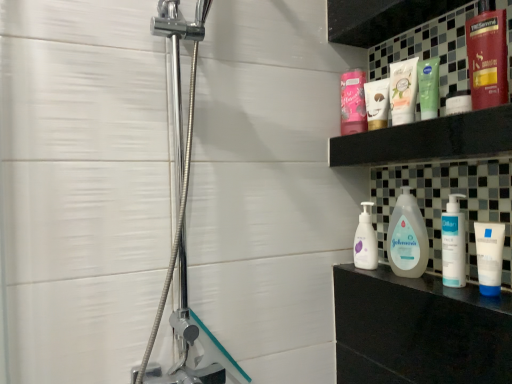
At what (x,y) coordinates should I click in order to perform the action: click on matte pink lotion at upper center, the 5th toiletry in the front-to-back sequence. Please return your answer as a coordinate pair (x, y). Image resolution: width=512 pixels, height=384 pixels. Looking at the image, I should click on (377, 103).

Based on the photo, what is the approximate height of shiny red hair conditioner at upper right, the 1th toiletry when ordered from front to back?

8.60 inches.

Where is `white pump bottle at right, which is counted as the third toiletry, starting from the front`? white pump bottle at right, which is counted as the third toiletry, starting from the front is located at coordinates (453, 243).

Identify the location of white matte pump bottle at right, which appears as the second cleaning product when viewed from the front. (365, 241).

Locate an element on the screen. The width and height of the screenshot is (512, 384). matte pink lotion at upper center, the second toiletry positioned from the back is located at coordinates (377, 103).

Is matte plastic bottles at upper right at the left side of white matte pump bottle at right, which appears as the second cleaning product when viewed from the front?

In fact, matte plastic bottles at upper right is to the right of white matte pump bottle at right, which appears as the second cleaning product when viewed from the front.

In the image, is matte plastic bottles at upper right positioned in front of or behind white matte pump bottle at right, which appears as the second cleaning product when viewed from the front?

In the image, matte plastic bottles at upper right appears in front of white matte pump bottle at right, which appears as the second cleaning product when viewed from the front.

Which is correct: matte plastic bottles at upper right is inside white matte pump bottle at right, which appears as the second cleaning product when viewed from the front, or outside of it?

The correct answer is: outside.

From the picture: From the image's perspective, which one is positioned higher, white matte pump bottle at right, which appears as the second cleaning product when viewed from the front, or pink matte jar at upper center, the 6th toiletry positioned from the front?

From the image's view, pink matte jar at upper center, the 6th toiletry positioned from the front, is above.

Is point (369, 260) positioned before point (362, 125)?

That is True.

Would you consider white matte pump bottle at right, positioned as the 1th cleaning product in back-to-front order, to be distant from pink matte jar at upper center, the 6th toiletry positioned from the front?

No, there isn't a large distance between white matte pump bottle at right, positioned as the 1th cleaning product in back-to-front order, and pink matte jar at upper center, the 6th toiletry positioned from the front.

Consider the image. Considering the relative sizes of white matte pump bottle at right, positioned as the 1th cleaning product in back-to-front order, and pink matte jar at upper center, the 6th toiletry positioned from the front, in the image provided, is white matte pump bottle at right, positioned as the 1th cleaning product in back-to-front order, shorter than pink matte jar at upper center, the 6th toiletry positioned from the front,?

Incorrect, the height of white matte pump bottle at right, positioned as the 1th cleaning product in back-to-front order, does not fall short of that of pink matte jar at upper center, the 6th toiletry positioned from the front.

Can you confirm if matte pink lotion at upper center, the second toiletry positioned from the back, is thinner than matte plastic bottles at upper right?

Correct, the width of matte pink lotion at upper center, the second toiletry positioned from the back, is less than that of matte plastic bottles at upper right.

Considering the relative sizes of matte pink lotion at upper center, the 5th toiletry in the front-to-back sequence, and matte plastic bottles at upper right in the image provided, is matte pink lotion at upper center, the 5th toiletry in the front-to-back sequence, taller than matte plastic bottles at upper right?

Yes, matte pink lotion at upper center, the 5th toiletry in the front-to-back sequence, is taller than matte plastic bottles at upper right.

Are matte pink lotion at upper center, the 5th toiletry in the front-to-back sequence, and matte plastic bottles at upper right far apart?

No, there isn't a large distance between matte pink lotion at upper center, the 5th toiletry in the front-to-back sequence, and matte plastic bottles at upper right.

Is white pump bottle at right, which is counted as the third toiletry, starting from the front, aimed at shiny red hair conditioner at upper right, the 1th toiletry when ordered from front to back?

No, white pump bottle at right, which is counted as the third toiletry, starting from the front, does not turn towards shiny red hair conditioner at upper right, the 1th toiletry when ordered from front to back.

Consider the image. Is white pump bottle at right, which is counted as the third toiletry, starting from the front, next to shiny red hair conditioner at upper right, the 1th toiletry when ordered from front to back, and touching it?

white pump bottle at right, which is counted as the third toiletry, starting from the front, and shiny red hair conditioner at upper right, the 1th toiletry when ordered from front to back, are not in contact.

Who is more distant, white pump bottle at right, the 4th toiletry in the back-to-front sequence, or shiny red hair conditioner at upper right, the 1th toiletry when ordered from front to back?

white pump bottle at right, the 4th toiletry in the back-to-front sequence.

Looking at this image, considering the relative sizes of green matte lotion at upper center, the 4th toiletry viewed from the front, and pink matte jar at upper center, which is the first toiletry in back-to-front order, in the image provided, is green matte lotion at upper center, the 4th toiletry viewed from the front, taller than pink matte jar at upper center, which is the first toiletry in back-to-front order,?

In fact, green matte lotion at upper center, the 4th toiletry viewed from the front, may be shorter than pink matte jar at upper center, which is the first toiletry in back-to-front order.

Which object is thinner, green matte lotion at upper center, the 3th toiletry when ordered from back to front, or pink matte jar at upper center, which is the first toiletry in back-to-front order?

pink matte jar at upper center, which is the first toiletry in back-to-front order.

Which is in front, point (418, 78) or point (346, 98)?

The point (418, 78) is more forward.

Is green matte lotion at upper center, the 4th toiletry viewed from the front, at the right side of pink matte jar at upper center, the 6th toiletry positioned from the front?

Yes, green matte lotion at upper center, the 4th toiletry viewed from the front, is to the right of pink matte jar at upper center, the 6th toiletry positioned from the front.

Which of these two, pink matte jar at upper center, which is the first toiletry in back-to-front order, or white matte toothpaste at upper center, is bigger?

Bigger between the two is white matte toothpaste at upper center.

From the image's perspective, is pink matte jar at upper center, the 6th toiletry positioned from the front, under white matte toothpaste at upper center?

No, from the image's perspective, pink matte jar at upper center, the 6th toiletry positioned from the front, is not below white matte toothpaste at upper center.

From a real-world perspective, is pink matte jar at upper center, the 6th toiletry positioned from the front, over white matte toothpaste at upper center?

Yes.

Image resolution: width=512 pixels, height=384 pixels. Find the location of `toothpaste located below the pink matte jar at upper center, which is the first toiletry in back-to-front order (from the image's perspective)`. toothpaste located below the pink matte jar at upper center, which is the first toiletry in back-to-front order (from the image's perspective) is located at coordinates (403, 91).

The image size is (512, 384). I want to click on the 1st cleaning product positioned below the pink matte jar at upper center, the 6th toiletry positioned from the front (from the image's perspective), so click(x=407, y=238).

Does pink matte jar at upper center, which is the first toiletry in back-to-front order, have a lesser height compared to white glossy johnson's baby lotion at center, the first cleaning product when ordered from front to back?

Yes.

Is pink matte jar at upper center, the 6th toiletry positioned from the front, completely or partially outside of white glossy johnson's baby lotion at center, which is the second cleaning product from back to front?

pink matte jar at upper center, the 6th toiletry positioned from the front, lies outside white glossy johnson's baby lotion at center, which is the second cleaning product from back to front,'s area.

Could you tell me if pink matte jar at upper center, the 6th toiletry positioned from the front, is facing white glossy johnson's baby lotion at center, the first cleaning product when ordered from front to back?

No, pink matte jar at upper center, the 6th toiletry positioned from the front, is not turned towards white glossy johnson's baby lotion at center, the first cleaning product when ordered from front to back.

The height and width of the screenshot is (384, 512). Identify the location of cleaning product that is the 2nd one below the matte plastic bottles at upper right (from a real-world perspective). [365, 241].

Find the location of a particular element. The image size is (512, 384). the 1st cleaning product to the right when counting from the pink matte jar at upper center, the 6th toiletry positioned from the front is located at coordinates (365, 241).

Consider the image. Looking at the image, which one is located further to white matte pump bottle at right, positioned as the 1th cleaning product in back-to-front order, white matte toothpaste at upper center or white glossy johnson's baby lotion at center, which is the second cleaning product from back to front?

white matte toothpaste at upper center.

In the scene shown: From the image, which object appears to be nearer to white glossy johnson's baby lotion at center, the first cleaning product when ordered from front to back, matte plastic bottles at upper right or white pump bottle at right, which is counted as the third toiletry, starting from the front?

white pump bottle at right, which is counted as the third toiletry, starting from the front, lies closer to white glossy johnson's baby lotion at center, the first cleaning product when ordered from front to back, than the other object.

Considering their positions, is white matte tube at right, arranged as the fifth toiletry when viewed from the back, positioned further to pink matte jar at upper center, the 6th toiletry positioned from the front, than shiny red hair conditioner at upper right, which is counted as the 6th toiletry, starting from the back?

Among the two, white matte tube at right, arranged as the fifth toiletry when viewed from the back, is located further to pink matte jar at upper center, the 6th toiletry positioned from the front.

Looking at the image, which one is located further to matte pink lotion at upper center, the 5th toiletry in the front-to-back sequence, matte plastic bottles at upper right or pink matte jar at upper center, which is the first toiletry in back-to-front order?

matte plastic bottles at upper right is further to matte pink lotion at upper center, the 5th toiletry in the front-to-back sequence.

Looking at the image, which one is located closer to green matte lotion at upper center, the 4th toiletry viewed from the front, matte plastic bottles at upper right or white matte toothpaste at upper center?

white matte toothpaste at upper center is positioned closer to the anchor green matte lotion at upper center, the 4th toiletry viewed from the front.

Looking at the image, which one is located further to matte pink lotion at upper center, the 5th toiletry in the front-to-back sequence, green matte lotion at upper center, the 3th toiletry when ordered from back to front, or white pump bottle at right, the 4th toiletry in the back-to-front sequence?

The object further to matte pink lotion at upper center, the 5th toiletry in the front-to-back sequence, is white pump bottle at right, the 4th toiletry in the back-to-front sequence.

Based on their spatial positions, is white matte tube at right, marked as the second toiletry in a front-to-back arrangement, or matte plastic bottles at upper right closer to white glossy johnson's baby lotion at center, the first cleaning product when ordered from front to back?

The object closer to white glossy johnson's baby lotion at center, the first cleaning product when ordered from front to back, is white matte tube at right, marked as the second toiletry in a front-to-back arrangement.

Estimate the real-world distances between objects in this image. Which object is closer to white matte pump bottle at right, positioned as the 1th cleaning product in back-to-front order, matte pink lotion at upper center, the second toiletry positioned from the back, or white matte tube at right, arranged as the fifth toiletry when viewed from the back?

matte pink lotion at upper center, the second toiletry positioned from the back, is closer to white matte pump bottle at right, positioned as the 1th cleaning product in back-to-front order.

You are a GUI agent. You are given a task and a screenshot of the screen. Output one action in this format:
    pyautogui.click(x=<x>, y=<y>)
    Task: Click on the toiletry between matte pink lotion at upper center, the 5th toiletry in the front-to-back sequence, and white matte pump bottle at right, which appears as the second cleaning product when viewed from the front, in the up-down direction
    
    Given the screenshot: What is the action you would take?
    pyautogui.click(x=453, y=243)

This screenshot has height=384, width=512. I want to click on cleaning product that lies between matte pink lotion at upper center, the second toiletry positioned from the back, and white pump bottle at right, which is counted as the third toiletry, starting from the front, from top to bottom, so click(407, 238).

Locate an element on the screen. toiletry that lies between matte plastic bottles at upper right and white matte tube at right, marked as the second toiletry in a front-to-back arrangement, from top to bottom is located at coordinates point(453,243).

In order to click on toothpaste between shiny red hair conditioner at upper right, the 1th toiletry when ordered from front to back, and white matte tube at right, arranged as the fifth toiletry when viewed from the back, in the up-down direction in this screenshot , I will do `click(403, 91)`.